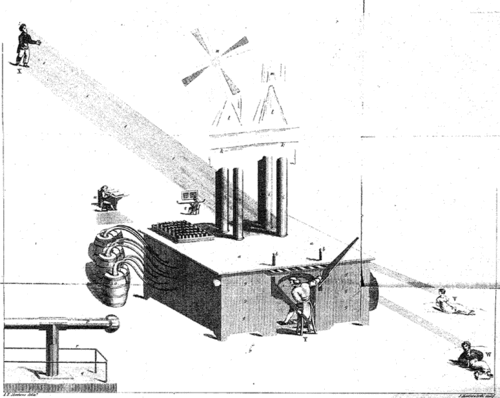
Find the location of a particular element. The image size is (500, 398). desk is located at coordinates [186, 201].